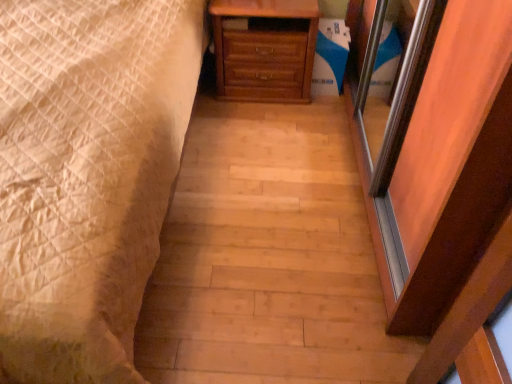
Question: Is wooden chest of drawers at center wider or thinner than white quilted bed at left?

Choices:
 (A) thin
 (B) wide

Answer: (A)

Question: From the image's perspective, relative to white quilted bed at left, is wooden chest of drawers at center above or below?

Choices:
 (A) above
 (B) below

Answer: (A)

Question: Is wooden chest of drawers at center to the left or to the right of white quilted bed at left in the image?

Choices:
 (A) left
 (B) right

Answer: (B)

Question: Is white quilted bed at left spatially inside wooden chest of drawers at center, or outside of it?

Choices:
 (A) outside
 (B) inside

Answer: (A)

Question: From the image's perspective, is white quilted bed at left above or below wooden chest of drawers at center?

Choices:
 (A) below
 (B) above

Answer: (A)

Question: Looking at the image, does white quilted bed at left seem bigger or smaller compared to wooden chest of drawers at center?

Choices:
 (A) big
 (B) small

Answer: (A)

Question: Would you say white quilted bed at left is to the left or to the right of wooden chest of drawers at center in the picture?

Choices:
 (A) right
 (B) left

Answer: (B)